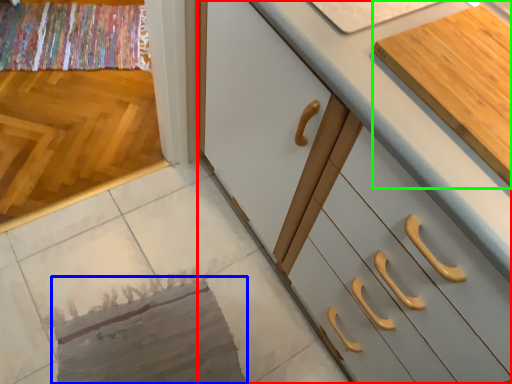
Question: Considering the real-world distances, which object is farthest from cabinetry (highlighted by a red box)? mat (highlighted by a blue box) or cabinetry (highlighted by a green box)?

Choices:
 (A) mat
 (B) cabinetry

Answer: (A)